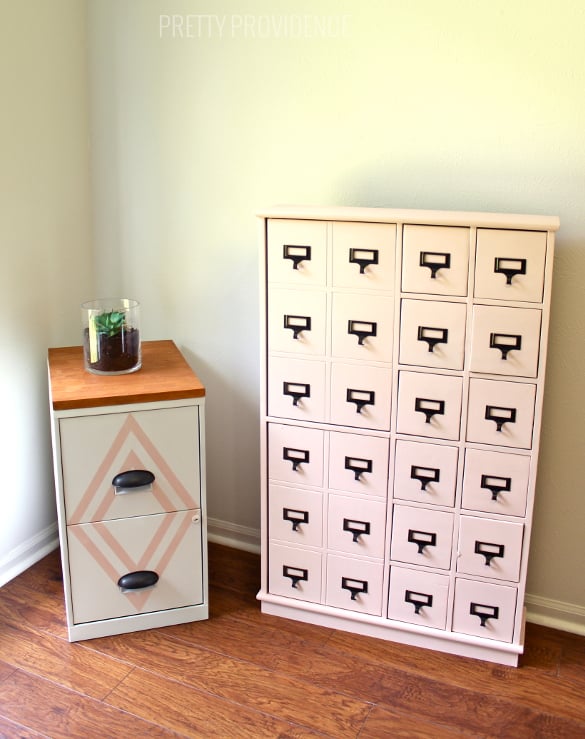
Locate an element on the screen. wood trim is located at coordinates (26, 544), (27, 554).